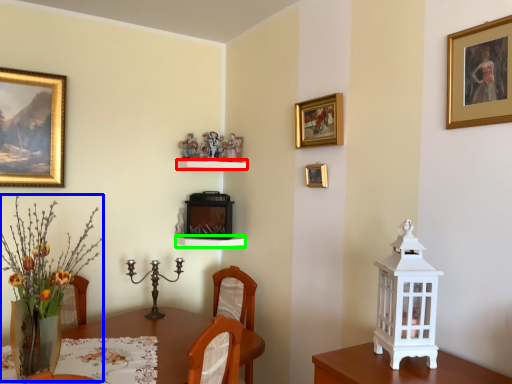
Question: Considering the real-world distances, which object is closest to shelf (highlighted by a red box)? floral arrangement (highlighted by a blue box) or shelf (highlighted by a green box).

Choices:
 (A) floral arrangement
 (B) shelf

Answer: (B)